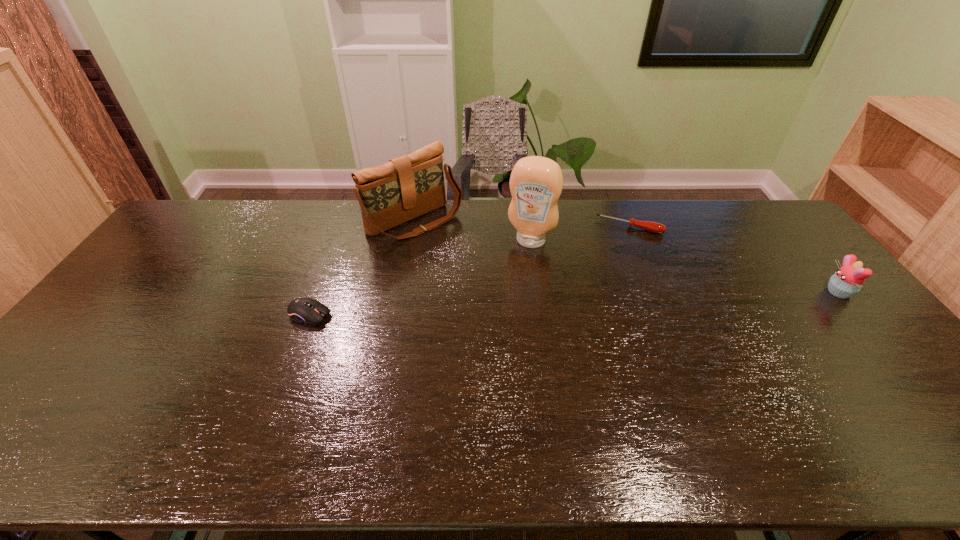
You are a GUI agent. You are given a task and a screenshot of the screen. Output one action in this format:
    pyautogui.click(x=<x>, y=<y>)
    Task: Click on the blank region between the cupcake and the fourth tallest object
    The width and height of the screenshot is (960, 540).
    Given the screenshot: What is the action you would take?
    pyautogui.click(x=574, y=303)

Identify which object is the nearest to the screwdriver. Please provide its 2D coordinates. Your answer should be formatted as a tuple, i.e. [(x, y)], where the tuple contains the x and y coordinates of a point satisfying the conditions above.

[(536, 182)]

Select which object is the second closest to the leftmost object. Please provide its 2D coordinates. Your answer should be formatted as a tuple, i.e. [(x, y)], where the tuple contains the x and y coordinates of a point satisfying the conditions above.

[(536, 182)]

Find the location of a particular element. This screenshot has width=960, height=540. vacant area in the image that satisfies the following two spatial constraints: 1. on the back side of the second shortest object; 2. on the left side of the fourth object from right to left is located at coordinates (345, 221).

You are a GUI agent. You are given a task and a screenshot of the screen. Output one action in this format:
    pyautogui.click(x=<x>, y=<y>)
    Task: Click on the free point that satisfies the following two spatial constraints: 1. on the back side of the shortest object; 2. on the right side of the computer mouse
    This screenshot has height=540, width=960.
    Given the screenshot: What is the action you would take?
    pyautogui.click(x=343, y=227)

Where is `blank space that satisfies the following two spatial constraints: 1. on the back side of the computer mouse; 2. on the face of the third shortest object`? This screenshot has width=960, height=540. blank space that satisfies the following two spatial constraints: 1. on the back side of the computer mouse; 2. on the face of the third shortest object is located at coordinates (319, 292).

Find the location of a particular element. This screenshot has width=960, height=540. vacant space that satisfies the following two spatial constraints: 1. on the front side of the shortest object; 2. on the right side of the shoulder bag is located at coordinates (414, 227).